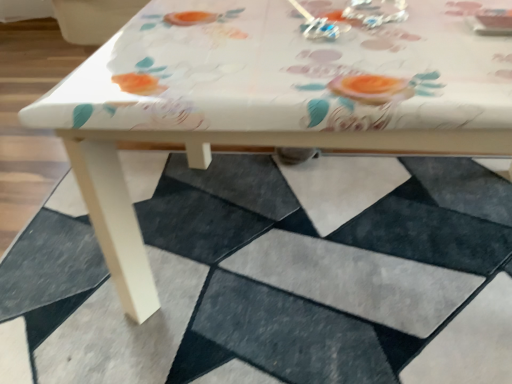
Find the location of a particular element. This screenshot has height=384, width=512. vacant space underneath white matte rug at lower center (from a real-world perspective) is located at coordinates (287, 289).